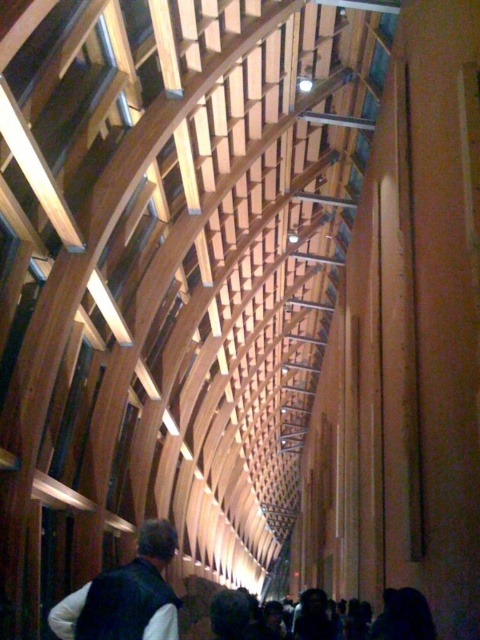
Question: Is the position of dark brown leather jacket at lower left less distant than that of dark hair at lower center?

Choices:
 (A) yes
 (B) no

Answer: (A)

Question: Which point is closer to the camera?

Choices:
 (A) dark brown leather jacket at lower left
 (B) dark hair at lower center

Answer: (A)

Question: Is dark brown leather jacket at lower left behind dark hair at lower center?

Choices:
 (A) no
 (B) yes

Answer: (A)

Question: Is dark brown leather jacket at lower left to the left of dark hair at lower center from the viewer's perspective?

Choices:
 (A) no
 (B) yes

Answer: (B)